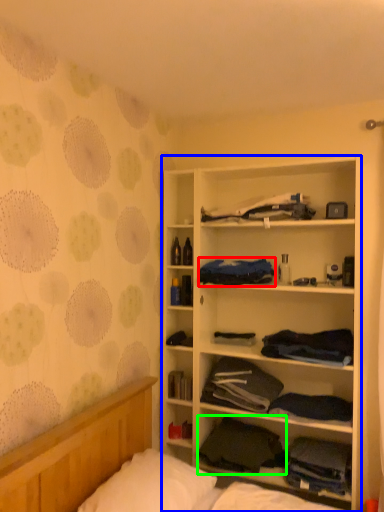
Question: Which object is positioned closest to clothing (highlighted by a red box)? Select from cabinetry (highlighted by a blue box) and clothing (highlighted by a green box).

Choices:
 (A) cabinetry
 (B) clothing

Answer: (A)